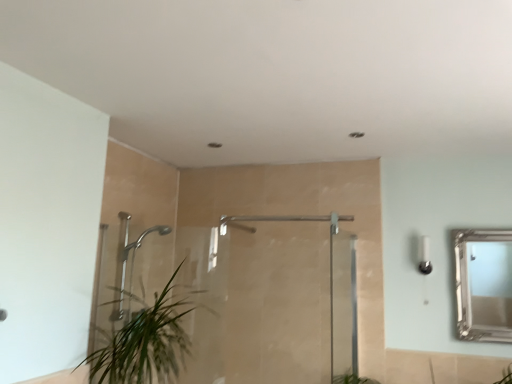
Question: Is the depth of green leafy plant at lower left greater than that of silver/glass mirror at upper right?

Choices:
 (A) yes
 (B) no

Answer: (B)

Question: From the image's perspective, is green leafy plant at lower left above silver/glass mirror at upper right?

Choices:
 (A) no
 (B) yes

Answer: (A)

Question: Is green leafy plant at lower left to the right of silver/glass mirror at upper right from the viewer's perspective?

Choices:
 (A) yes
 (B) no

Answer: (B)

Question: Can you see green leafy plant at lower left touching silver/glass mirror at upper right?

Choices:
 (A) yes
 (B) no

Answer: (B)

Question: Can we say green leafy plant at lower left lies outside silver/glass mirror at upper right?

Choices:
 (A) no
 (B) yes

Answer: (B)

Question: Is green leafy plant at lower left oriented away from silver/glass mirror at upper right?

Choices:
 (A) no
 (B) yes

Answer: (A)

Question: Considering the relative sizes of polished chrome shower head at left, the 1th shower in the left-to-right sequence, and satin nickel shower at center, acting as the 1th shower starting from the right, in the image provided, is polished chrome shower head at left, the 1th shower in the left-to-right sequence, bigger than satin nickel shower at center, acting as the 1th shower starting from the right,?

Choices:
 (A) yes
 (B) no

Answer: (A)

Question: From a real-world perspective, is polished chrome shower head at left, placed as the second shower when sorted from right to left, physically above satin nickel shower at center, the second shower positioned from the left?

Choices:
 (A) yes
 (B) no

Answer: (B)

Question: From a real-world perspective, is polished chrome shower head at left, the 1th shower in the left-to-right sequence, below satin nickel shower at center, the second shower positioned from the left?

Choices:
 (A) yes
 (B) no

Answer: (A)

Question: Is polished chrome shower head at left, the 1th shower in the left-to-right sequence, not within satin nickel shower at center, acting as the 1th shower starting from the right?

Choices:
 (A) yes
 (B) no

Answer: (A)

Question: Does polished chrome shower head at left, the 1th shower in the left-to-right sequence, lie behind satin nickel shower at center, the second shower positioned from the left?

Choices:
 (A) yes
 (B) no

Answer: (A)

Question: Can you confirm if polished chrome shower head at left, placed as the second shower when sorted from right to left, is taller than satin nickel shower at center, acting as the 1th shower starting from the right?

Choices:
 (A) yes
 (B) no

Answer: (A)

Question: Considering the relative sizes of polished chrome shower head at left, placed as the second shower when sorted from right to left, and green leafy plant at lower left in the image provided, is polished chrome shower head at left, placed as the second shower when sorted from right to left, bigger than green leafy plant at lower left?

Choices:
 (A) no
 (B) yes

Answer: (A)